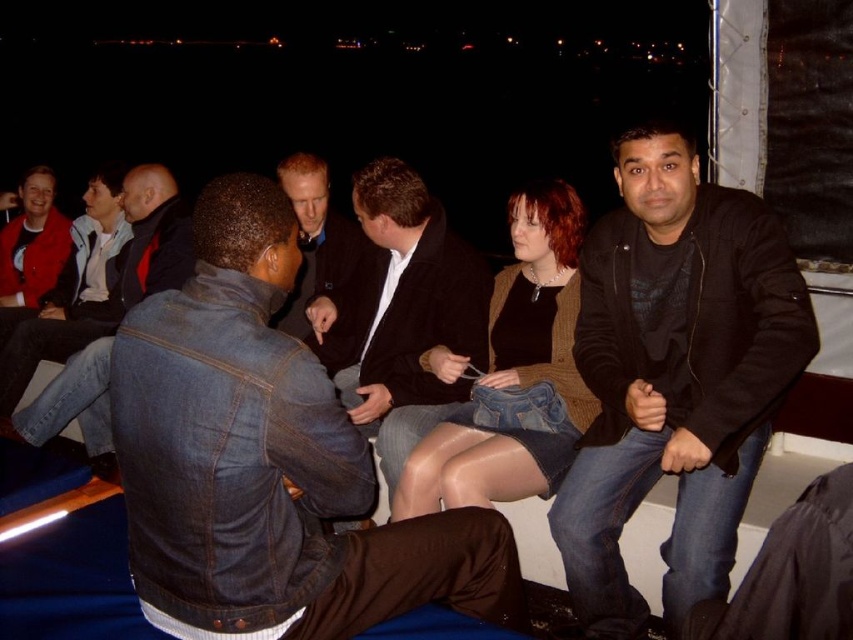
Describe the element at coordinates (674, 376) in the screenshot. I see `black leather jacket at right` at that location.

Does black leather jacket at right have a greater width compared to dark brown leather jacket at center?

Incorrect, black leather jacket at right's width does not surpass dark brown leather jacket at center's.

Between point (717, 500) and point (357, 280), which one is positioned in front?

Positioned in front is point (717, 500).

Where is `black leather jacket at right`? The height and width of the screenshot is (640, 853). black leather jacket at right is located at coordinates (674, 376).

Does shiny brown jacket at center have a smaller size compared to matte red jacket at left?

Indeed, shiny brown jacket at center has a smaller size compared to matte red jacket at left.

Between shiny brown jacket at center and matte red jacket at left, which one appears on the right side from the viewer's perspective?

shiny brown jacket at center

Which is in front, point (525, 392) or point (10, 305)?

Point (525, 392) is more forward.

This screenshot has width=853, height=640. Find the location of `shiny brown jacket at center`. shiny brown jacket at center is located at coordinates (514, 374).

Does denim jacket at lower right appear under matte red jacket at left?

Yes, denim jacket at lower right is below matte red jacket at left.

Does denim jacket at lower right have a larger size compared to matte red jacket at left?

Indeed, denim jacket at lower right has a larger size compared to matte red jacket at left.

This screenshot has width=853, height=640. Identify the location of denim jacket at lower right. (268, 460).

The height and width of the screenshot is (640, 853). In order to click on denim jacket at lower right in this screenshot , I will do `click(268, 460)`.